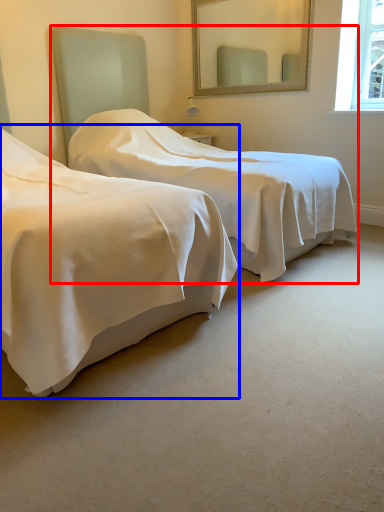
Question: Which object appears farthest to the camera in this image, bed (highlighted by a red box) or bed (highlighted by a blue box)?

Choices:
 (A) bed
 (B) bed

Answer: (A)